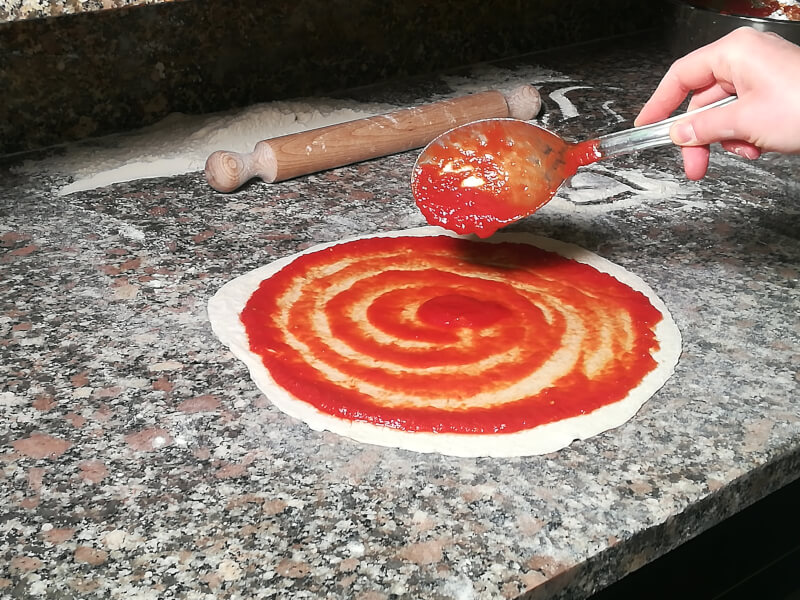
This screenshot has height=600, width=800. Identify the location of handle. (661, 135).